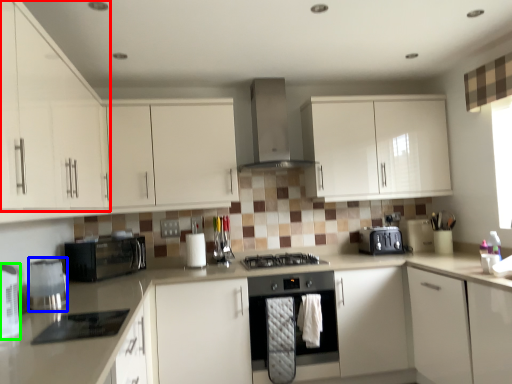
Question: Which is nearer to the cabinetry (highlighted by a red box)? kitchen appliance (highlighted by a blue box) or appliance (highlighted by a green box).

Choices:
 (A) kitchen appliance
 (B) appliance

Answer: (A)